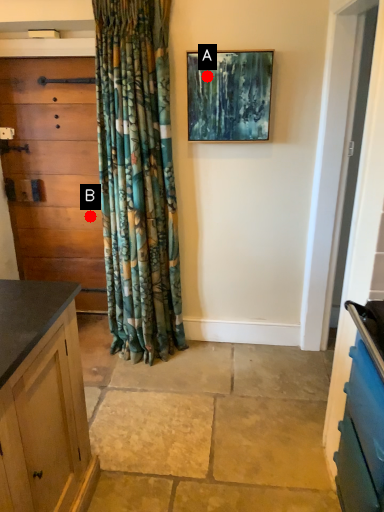
Question: Two points are circled on the image, labeled by A and B beside each circle. Among these points, which one is nearest to the camera?

Choices:
 (A) A is closer
 (B) B is closer

Answer: (A)